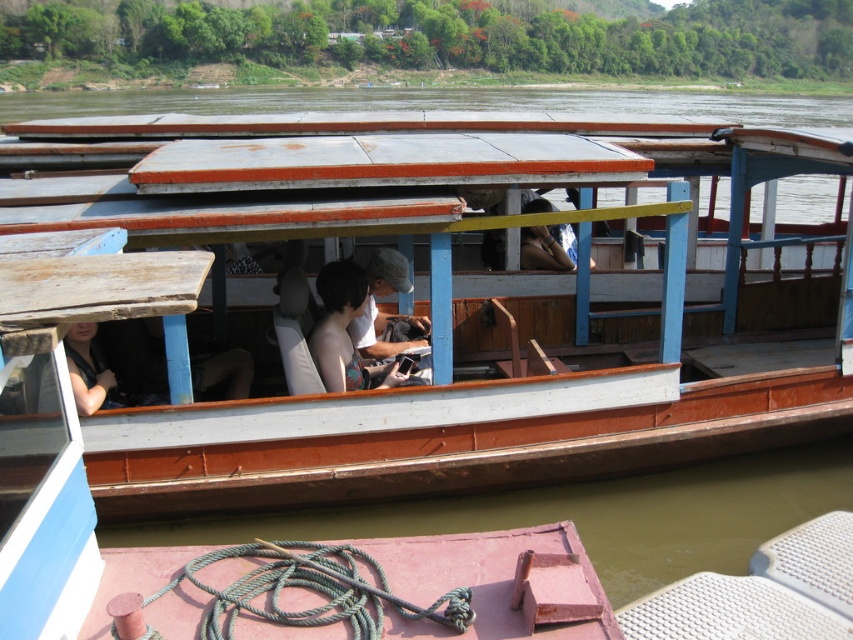
You are a photographer on the boat and need to take a clear picture of both the skinny white shirt at center and the matte black shirt at center. Which shirt should you focus on first to ensure it appears in focus given their heights?

The skinny white shirt at center is taller than the matte black shirt at center, so you should focus on the skinny white shirt at center first to ensure proper focus.

You are a photographer standing on the riverbank and want to take a photo of the wooden boat at center and the matte black shirt at center. Which object should you focus on first to ensure both are in sharp focus?

You should focus on the wooden boat at center first because it is closer to you than the matte black shirt at center, so focusing on the closer object will help both be in focus.